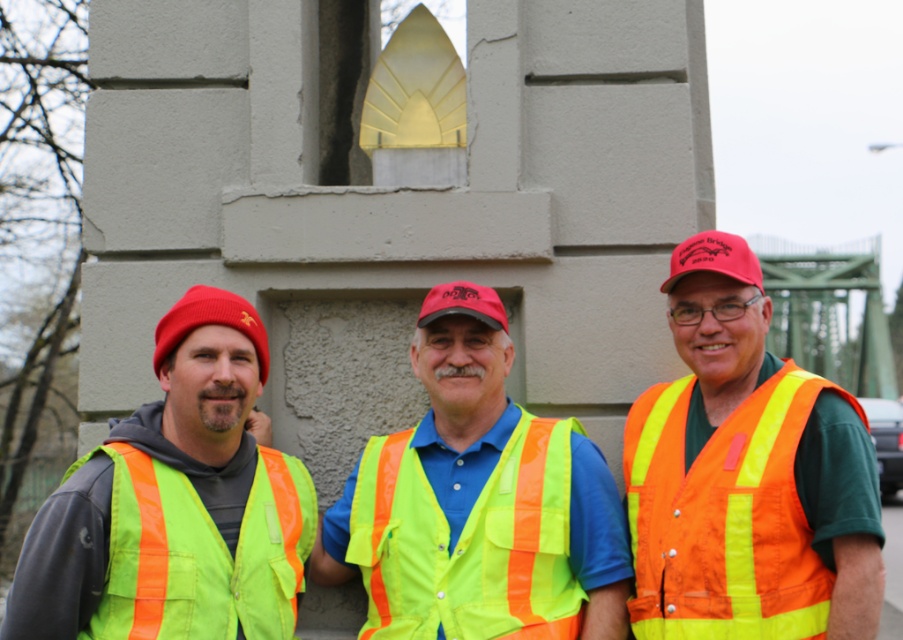
Question: Can you confirm if red knit beanie at left is positioned above matte black cap at center?

Choices:
 (A) no
 (B) yes

Answer: (A)

Question: Does neon yellow reflective safety vest at center have a larger size compared to red fabric cap at center?

Choices:
 (A) no
 (B) yes

Answer: (B)

Question: Among these objects, which one is farthest from the camera?

Choices:
 (A) matte black cap at center
 (B) neon green reflective safety vest at left
 (C) orange reflective safety vest at right
 (D) high visibility vest at center

Answer: (A)

Question: Among these objects, which one is nearest to the camera?

Choices:
 (A) matte black cap at center
 (B) high visibility vest at center
 (C) neon yellow reflective safety vest at center
 (D) orange reflective safety vest at right

Answer: (D)

Question: Estimate the real-world distances between objects in this image. Which object is farther from the neon yellow reflective safety vest at center?

Choices:
 (A) matte green safety vest at center
 (B) red knit beanie at left
 (C) neon green reflective safety vest at left
 (D) high visibility vest at center

Answer: (B)

Question: Can you confirm if neon yellow reflective safety vest at center is positioned to the left of neon green reflective safety vest at left?

Choices:
 (A) no
 (B) yes

Answer: (A)